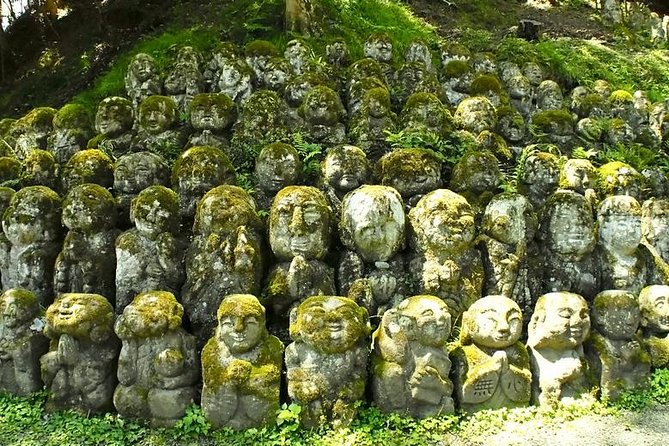
Identify the location of shade. The image size is (669, 446). (41, 56).